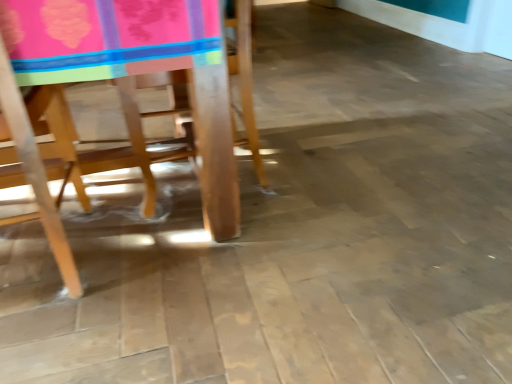
Where is `wooden chair at left, which appears as the 1th chair when viewed from the right`? The height and width of the screenshot is (384, 512). wooden chair at left, which appears as the 1th chair when viewed from the right is located at coordinates 137,68.

What is the approximate height of wooden chair at left, which appears as the 1th chair when viewed from the right?

wooden chair at left, which appears as the 1th chair when viewed from the right, is 26.32 inches tall.

This screenshot has height=384, width=512. What do you see at coordinates (137, 68) in the screenshot?
I see `wooden chair at left, the 2th chair from the left` at bounding box center [137, 68].

This screenshot has height=384, width=512. What do you see at coordinates (36, 173) in the screenshot? I see `wooden chair at left, the 1th chair from the left` at bounding box center [36, 173].

Based on the photo, in order to face wooden chair at left, positioned as the 2th chair in right-to-left order, should I rotate leftwards or rightwards?

To align with it, rotate left about 31.417°.

This screenshot has width=512, height=384. I want to click on wooden chair at left, the 1th chair from the left, so click(x=36, y=173).

Locate an element on the screen. The height and width of the screenshot is (384, 512). wooden chair at left, the 2th chair from the left is located at coordinates (137, 68).

Considering the relative positions of wooden chair at left, the 1th chair from the left, and wooden chair at left, the 2th chair from the left, in the image provided, is wooden chair at left, the 1th chair from the left, to the left of wooden chair at left, the 2th chair from the left, from the viewer's perspective?

Correct, you'll find wooden chair at left, the 1th chair from the left, to the left of wooden chair at left, the 2th chair from the left.

Looking at this image, which object is further away from the camera taking this photo, wooden chair at left, positioned as the 2th chair in right-to-left order, or wooden chair at left, the 2th chair from the left?

wooden chair at left, the 2th chair from the left.

Does point (64, 268) come behind point (226, 152)?

No.

Based on the photo, from the image's perspective, is wooden chair at left, the 1th chair from the left, below wooden chair at left, which appears as the 1th chair when viewed from the right?

Indeed, from the image's perspective, wooden chair at left, the 1th chair from the left, is shown beneath wooden chair at left, which appears as the 1th chair when viewed from the right.

From the picture: From a real-world perspective, between wooden chair at left, positioned as the 2th chair in right-to-left order, and wooden chair at left, which appears as the 1th chair when viewed from the right, who is vertically higher?

From a 3D spatial view, wooden chair at left, which appears as the 1th chair when viewed from the right, is above.

Can you confirm if wooden chair at left, positioned as the 2th chair in right-to-left order, is thinner than wooden chair at left, the 2th chair from the left?

Indeed, wooden chair at left, positioned as the 2th chair in right-to-left order, has a lesser width compared to wooden chair at left, the 2th chair from the left.

Is wooden chair at left, the 1th chair from the left, shorter than wooden chair at left, which appears as the 1th chair when viewed from the right?

No.

Who is smaller, wooden chair at left, the 1th chair from the left, or wooden chair at left, which appears as the 1th chair when viewed from the right?

With smaller size is wooden chair at left, the 1th chair from the left.

Looking at this image, can we say wooden chair at left, the 1th chair from the left, lies outside wooden chair at left, which appears as the 1th chair when viewed from the right?

No.

Is wooden chair at left, positioned as the 2th chair in right-to-left order, far from wooden chair at left, which appears as the 1th chair when viewed from the right?

No.

Does wooden chair at left, the 1th chair from the left, turn towards wooden chair at left, the 2th chair from the left?

Yes, wooden chair at left, the 1th chair from the left, is aimed at wooden chair at left, the 2th chair from the left.

Based on the photo, how many degrees apart are the facing directions of wooden chair at left, the 1th chair from the left, and wooden chair at left, which appears as the 1th chair when viewed from the right?

The facing directions of wooden chair at left, the 1th chair from the left, and wooden chair at left, which appears as the 1th chair when viewed from the right, are 179 degrees apart.

This screenshot has width=512, height=384. I want to click on chair below the wooden chair at left, which appears as the 1th chair when viewed from the right (from the image's perspective), so click(36, 173).

Considering the positions of objects wooden chair at left, the 2th chair from the left, and wooden chair at left, the 1th chair from the left, in the image provided, who is more to the left, wooden chair at left, the 2th chair from the left, or wooden chair at left, the 1th chair from the left,?

Positioned to the left is wooden chair at left, the 1th chair from the left.

Does wooden chair at left, the 2th chair from the left, come in front of wooden chair at left, the 1th chair from the left?

No, wooden chair at left, the 2th chair from the left, is further to the viewer.

Which is farther from the camera, (120, 51) or (45, 176)?

Positioned behind is point (45, 176).

From the image's perspective, is wooden chair at left, which appears as the 1th chair when viewed from the right, on top of wooden chair at left, the 1th chair from the left?

Yes, from the image's perspective, wooden chair at left, which appears as the 1th chair when viewed from the right, is above wooden chair at left, the 1th chair from the left.

From a real-world perspective, is wooden chair at left, which appears as the 1th chair when viewed from the right, located higher than wooden chair at left, positioned as the 2th chair in right-to-left order?

Yes, from a real-world perspective, wooden chair at left, which appears as the 1th chair when viewed from the right, is above wooden chair at left, positioned as the 2th chair in right-to-left order.

Is wooden chair at left, the 2th chair from the left, wider or thinner than wooden chair at left, positioned as the 2th chair in right-to-left order?

In the image, wooden chair at left, the 2th chair from the left, appears to be wider than wooden chair at left, positioned as the 2th chair in right-to-left order.

Between wooden chair at left, which appears as the 1th chair when viewed from the right, and wooden chair at left, the 1th chair from the left, which one has more height?

With more height is wooden chair at left, the 1th chair from the left.

Is wooden chair at left, which appears as the 1th chair when viewed from the right, bigger or smaller than wooden chair at left, positioned as the 2th chair in right-to-left order?

In the image, wooden chair at left, which appears as the 1th chair when viewed from the right, appears to be larger than wooden chair at left, positioned as the 2th chair in right-to-left order.

Would you say wooden chair at left, which appears as the 1th chair when viewed from the right, is inside or outside wooden chair at left, positioned as the 2th chair in right-to-left order?

wooden chair at left, which appears as the 1th chair when viewed from the right, is not inside wooden chair at left, positioned as the 2th chair in right-to-left order, it's outside.

Is wooden chair at left, the 2th chair from the left, not close to wooden chair at left, positioned as the 2th chair in right-to-left order?

No, there isn't a large distance between wooden chair at left, the 2th chair from the left, and wooden chair at left, positioned as the 2th chair in right-to-left order.

Is wooden chair at left, which appears as the 1th chair when viewed from the right, facing towards wooden chair at left, the 1th chair from the left?

Yes.

Can you tell me how much wooden chair at left, which appears as the 1th chair when viewed from the right, and wooden chair at left, the 1th chair from the left, differ in facing direction?

wooden chair at left, which appears as the 1th chair when viewed from the right, and wooden chair at left, the 1th chair from the left, are facing 179 degrees away from each other.

Consider the image. How distant is wooden chair at left, which appears as the 1th chair when viewed from the right, from wooden chair at left, the 1th chair from the left?

wooden chair at left, which appears as the 1th chair when viewed from the right, is 11.26 inches away from wooden chair at left, the 1th chair from the left.

Find the location of a particular element. The height and width of the screenshot is (384, 512). chair that appears on the left of wooden chair at left, the 2th chair from the left is located at coordinates (36, 173).

You are a GUI agent. You are given a task and a screenshot of the screen. Output one action in this format:
    pyautogui.click(x=<x>, y=<y>)
    Task: Click on the chair above the wooden chair at left, the 1th chair from the left (from the image's perspective)
    This screenshot has height=384, width=512.
    Given the screenshot: What is the action you would take?
    pyautogui.click(x=137, y=68)

In the image, there is a wooden chair at left, which appears as the 1th chair when viewed from the right. Where is `chair below it (from a real-world perspective)`? The height and width of the screenshot is (384, 512). chair below it (from a real-world perspective) is located at coordinates (36, 173).